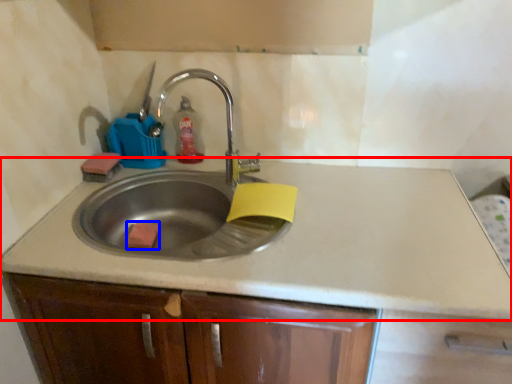
Question: Which object is closer to the camera taking this photo, countertop (highlighted by a red box) or soap (highlighted by a blue box)?

Choices:
 (A) countertop
 (B) soap

Answer: (A)